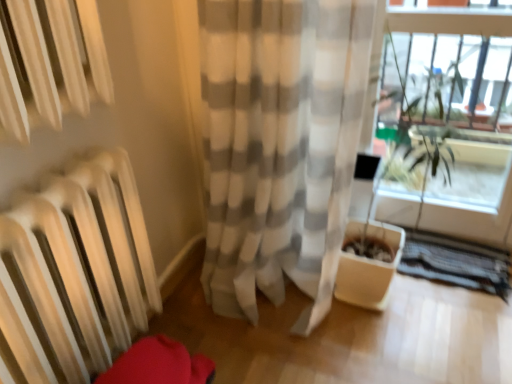
Question: Relative to clear glass window frame at upper right, is white sheer curtain at center in front or behind?

Choices:
 (A) front
 (B) behind

Answer: (A)

Question: Looking at their shapes, would you say white sheer curtain at center is wider or thinner than clear glass window frame at upper right?

Choices:
 (A) wide
 (B) thin

Answer: (A)

Question: From a real-world perspective, is white sheer curtain at center above or below clear glass window frame at upper right?

Choices:
 (A) above
 (B) below

Answer: (A)

Question: Is clear glass window frame at upper right bigger or smaller than white sheer curtain at center?

Choices:
 (A) small
 (B) big

Answer: (A)

Question: Visually, is clear glass window frame at upper right positioned to the left or to the right of white sheer curtain at center?

Choices:
 (A) left
 (B) right

Answer: (B)

Question: Does point (418, 99) appear closer or farther from the camera than point (348, 104)?

Choices:
 (A) closer
 (B) farther

Answer: (B)

Question: From the image's perspective, is clear glass window frame at upper right positioned above or below white sheer curtain at center?

Choices:
 (A) below
 (B) above

Answer: (B)